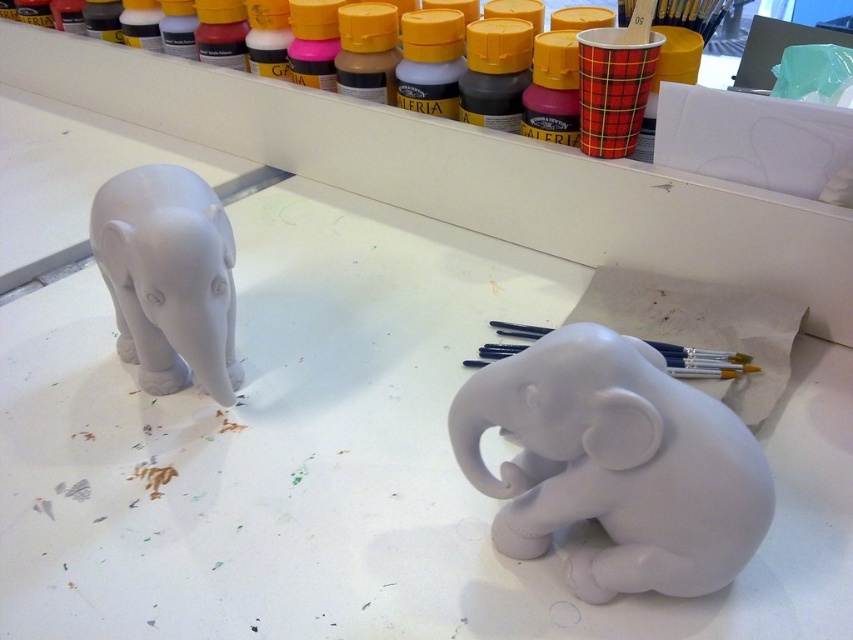
Question: Can you confirm if white matte elephant at lower right is positioned below white matte elephant at left?

Choices:
 (A) yes
 (B) no

Answer: (A)

Question: Does white matte elephant at lower right have a larger size compared to white matte elephant at left?

Choices:
 (A) no
 (B) yes

Answer: (A)

Question: Observing the image, what is the correct spatial positioning of white matte elephant at lower right in reference to white matte elephant at left?

Choices:
 (A) left
 (B) right

Answer: (B)

Question: Which point is farther to the camera?

Choices:
 (A) (535, 547)
 (B) (166, 272)

Answer: (B)

Question: Among these points, which one is farthest from the camera?

Choices:
 (A) (149, 308)
 (B) (526, 358)

Answer: (A)